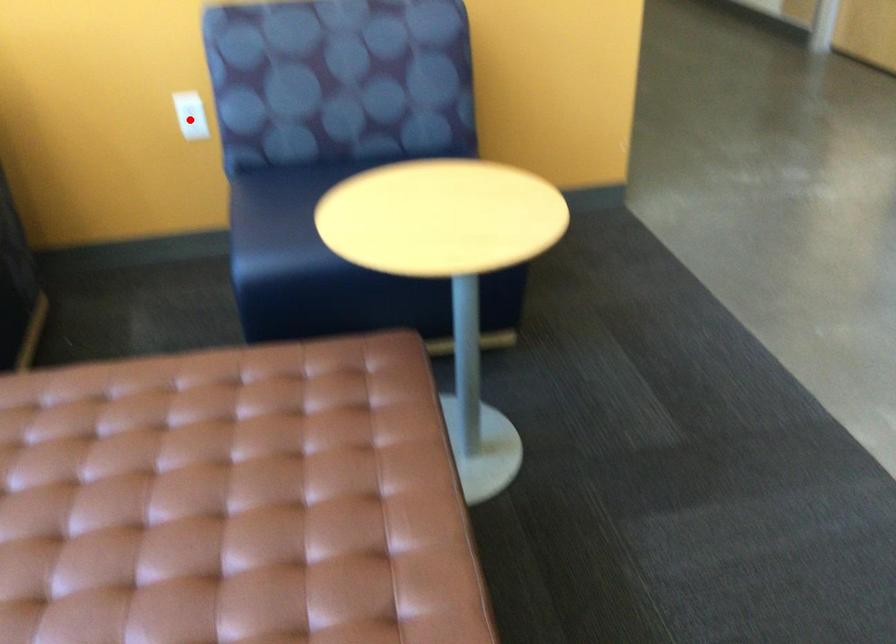
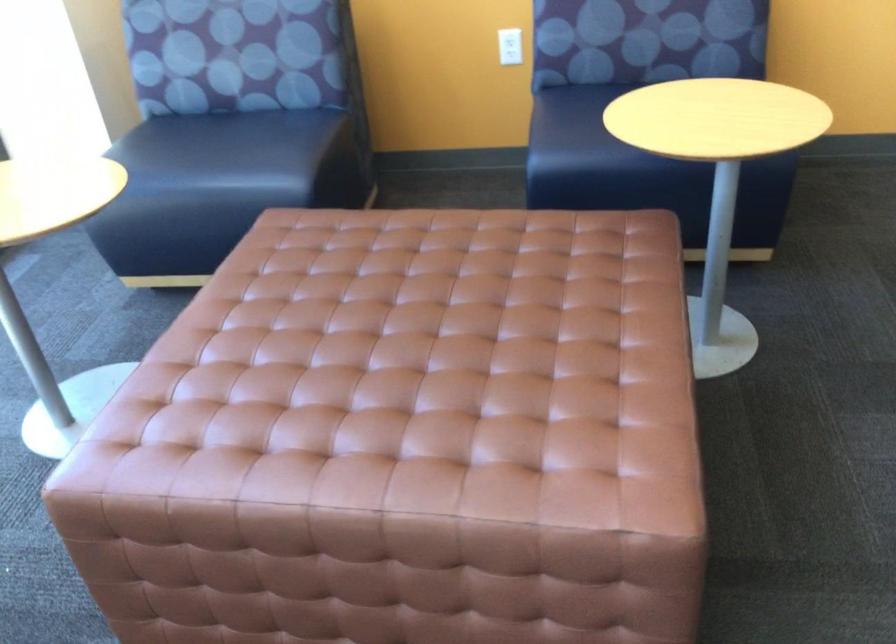
Locate, in the second image, the point that corresponds to the highlighted location in the first image.

(510, 46)